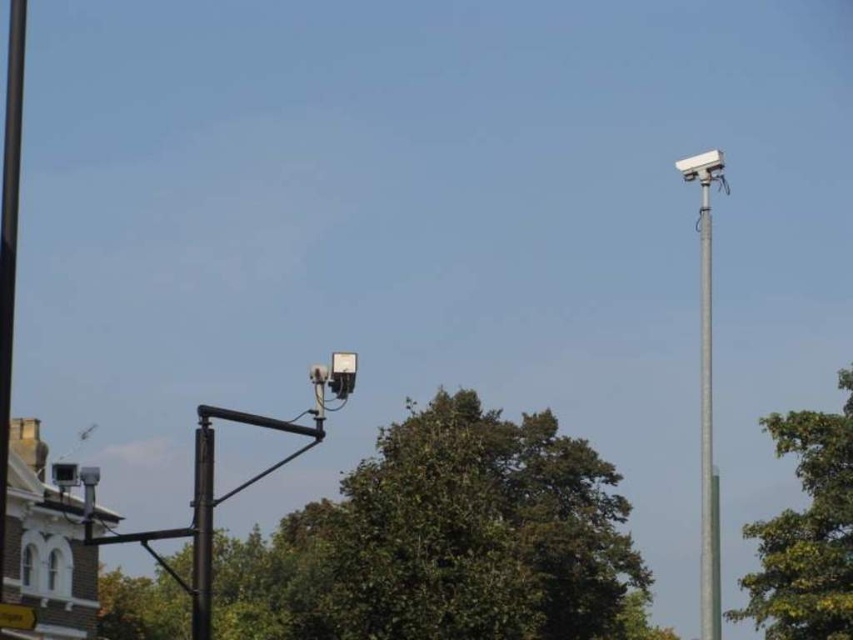
Which is above, green leafy tree at center or silver metallic pole at upper right?

Positioned higher is silver metallic pole at upper right.

Between point (555, 515) and point (705, 508), which one is positioned in front?

Point (705, 508) is in front.

Image resolution: width=853 pixels, height=640 pixels. I want to click on green leafy tree at center, so click(x=447, y=541).

Does white plastic security camera at upper right have a smaller size compared to silver metallic pole at upper right?

Incorrect, white plastic security camera at upper right is not smaller in size than silver metallic pole at upper right.

Between white plastic security camera at upper right and silver metallic pole at upper right, which one appears on the right side from the viewer's perspective?

Positioned to the right is silver metallic pole at upper right.

Between point (714, 172) and point (704, 592), which one is positioned behind?

Point (714, 172)

This screenshot has height=640, width=853. I want to click on white plastic security camera at upper right, so click(706, 390).

Which is in front, point (708, 177) or point (199, 588)?

Positioned in front is point (199, 588).

Does silver metallic pole at upper right have a larger size compared to black metal pole at center?

Indeed, silver metallic pole at upper right has a larger size compared to black metal pole at center.

This screenshot has width=853, height=640. What are the coordinates of `silver metallic pole at upper right` in the screenshot? It's located at (706, 422).